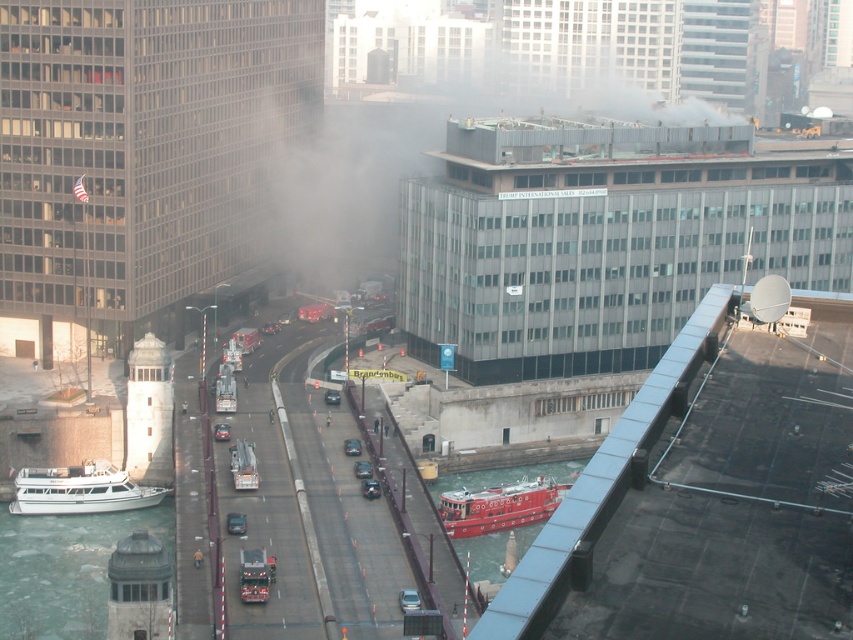
Can you confirm if greenish water at lower left is thinner than white matte boat at lower left?

No, greenish water at lower left is not thinner than white matte boat at lower left.

Image resolution: width=853 pixels, height=640 pixels. I want to click on greenish water at lower left, so click(x=64, y=570).

You are a GUI agent. You are given a task and a screenshot of the screen. Output one action in this format:
    pyautogui.click(x=<x>, y=<y>)
    Task: Click on the greenish water at lower left
    The image size is (853, 640).
    Given the screenshot: What is the action you would take?
    coord(64,570)

Is greenish water at lower left bigger than red rubber fireboat at center?

Yes, greenish water at lower left is bigger than red rubber fireboat at center.

Between point (0, 620) and point (567, 490), which one is positioned behind?

Point (567, 490)

Is point (163, 509) less distant than point (454, 500)?

No, it is behind (454, 500).

The height and width of the screenshot is (640, 853). What are the coordinates of `greenish water at lower left` in the screenshot? It's located at (64, 570).

Does greenish water at lower left appear on the left side of smooth red boat at lower center?

Correct, you'll find greenish water at lower left to the left of smooth red boat at lower center.

The image size is (853, 640). What do you see at coordinates (64, 570) in the screenshot?
I see `greenish water at lower left` at bounding box center [64, 570].

Identify the location of greenish water at lower left. pyautogui.click(x=64, y=570).